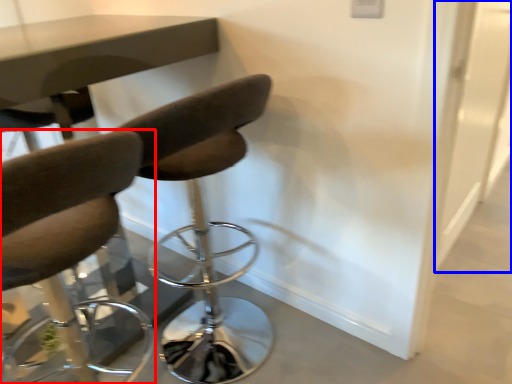
Question: Which of the following is the farthest to the observer, chair (highlighted by a red box) or glass door (highlighted by a blue box)?

Choices:
 (A) chair
 (B) glass door

Answer: (B)